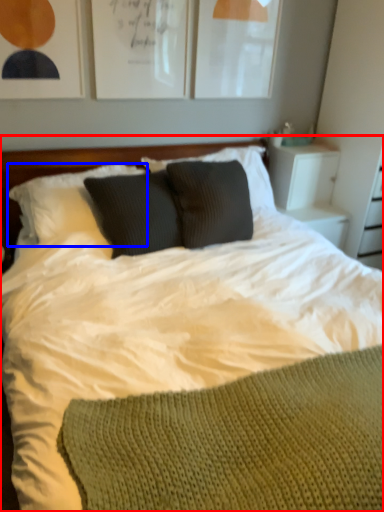
Question: Which object appears closest to the camera in this image, bed (highlighted by a red box) or pillow (highlighted by a blue box)?

Choices:
 (A) bed
 (B) pillow

Answer: (A)